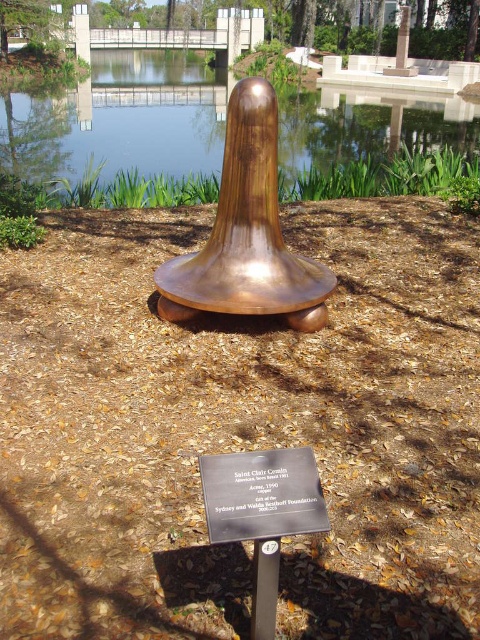
You are standing in front of the sculpture and want to touch both points on it. Which point should you reach for first, point at coordinate (188, 300) or point at coordinate (288, 515)?

You should reach for point at coordinate (188, 300) first because it is closer to you than point at coordinate (288, 515).